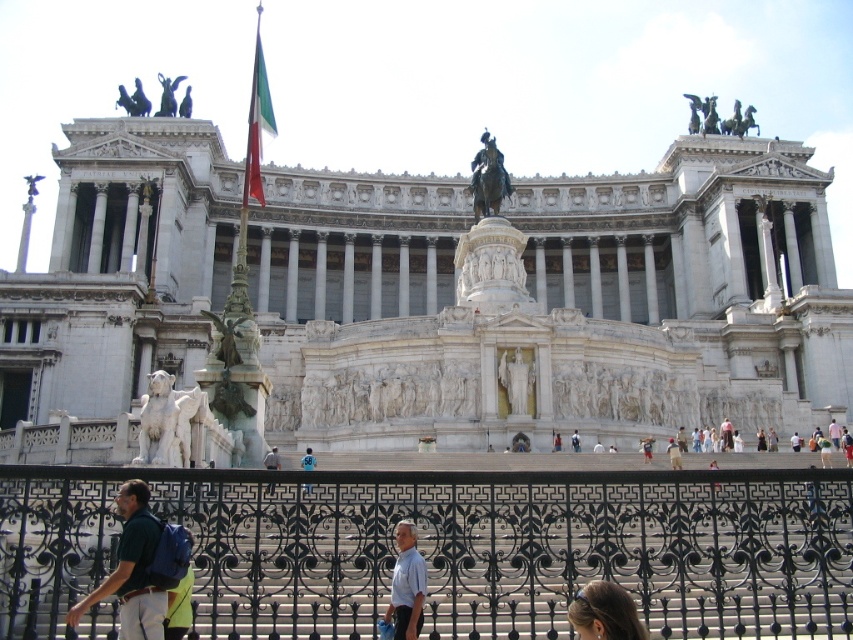
Question: Which point is closer to the camera?

Choices:
 (A) polished silk flag at center
 (B) light blue shirt at lower center
 (C) white marble lion at lower left

Answer: (B)

Question: Can you confirm if white marble statue at center is positioned above light blue denim shorts at lower center?

Choices:
 (A) yes
 (B) no

Answer: (A)

Question: Is black wrought iron fence at lower center above white marble lion at lower left?

Choices:
 (A) no
 (B) yes

Answer: (A)

Question: Based on their relative distances, which object is farther from the white marble palace at center?

Choices:
 (A) black wrought iron fence at lower center
 (B) smooth brown hair at lower center
 (C) light blue denim shorts at lower center

Answer: (B)

Question: Does white marble lion at lower left come in front of bronze statue at center?

Choices:
 (A) yes
 (B) no

Answer: (A)

Question: Which point is closer to the camera?

Choices:
 (A) smooth brown hair at lower center
 (B) light blue shirt at lower center
 (C) light blue denim shorts at lower center
 (D) black wrought iron fence at lower center

Answer: (A)